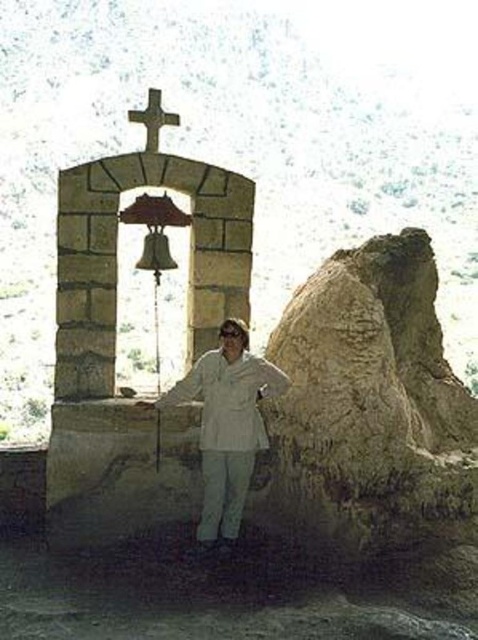
You are a photographer trying to capture a clear shot of both the white matte jacket at center and the metallic cross at upper center. Since the camera can only focus on one object at a time, which object should you choose to ensure the larger one is in focus?

The white matte jacket at center is bigger than the metallic cross at upper center, so you should focus on the white matte jacket at center to ensure the larger object is in focus.

You are standing at the point marked by the coordinates point (227, 424) in the image. Looking around, you see the stone structure with a bell and cross. What object are you currently standing on?

The point (227, 424) corresponds to the white matte jacket at center, so you are standing on the white matte jacket at center.